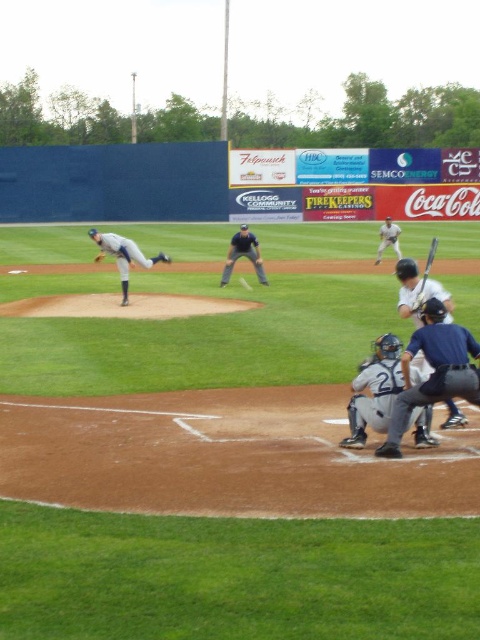
You are a spectator at the baseball game and want to take a photo of the dark blue uniform at lower right and the white matte baseball bat at upper right. Based on their positions, which object is closer to the left side of your camera frame?

The dark blue uniform at lower right is positioned on the left side of white matte baseball bat at upper right, so it is closer to the left side of your camera frame.

Based on the scene description, where is the gray matte uniform at center located in terms of its 2D coordinates?

The gray matte uniform at center is located at the 2D coordinates point (123, 256).

You are a photographer standing at the edge of the field. You want to take a photo that includes both the dark blue uniform at lower right and the white matte catcher at center. Which object should you position closer to the camera to ensure both are in focus?

The dark blue uniform at lower right is taller than the white matte catcher at center, so you should position the dark blue uniform at lower right closer to the camera to ensure both are in focus.